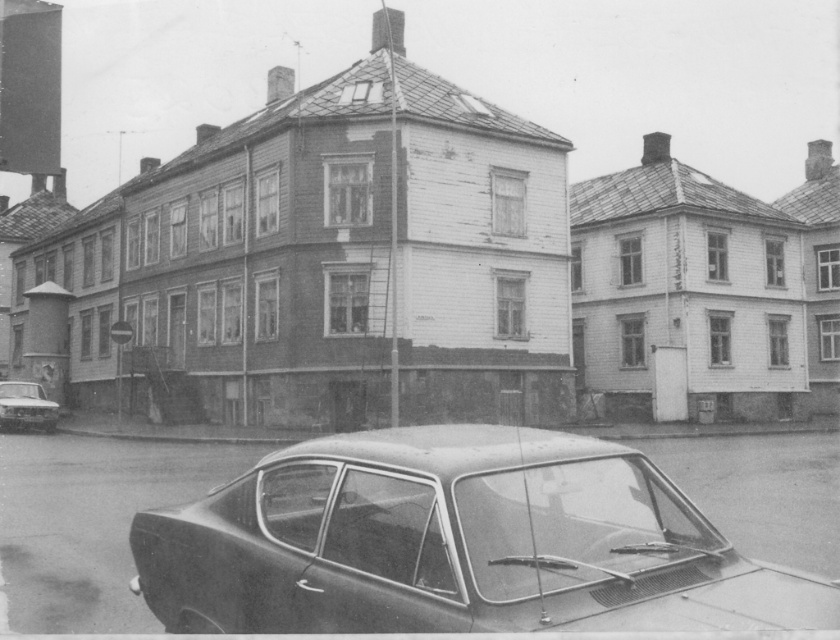
Can you confirm if dark gray metallic car at lower center is positioned above shiny silver sedan at lower left?

Yes.

Is point (581, 566) positioned behind point (24, 394)?

No, (581, 566) is closer to viewer.

Locate an element on the screen. dark gray metallic car at lower center is located at coordinates point(457,544).